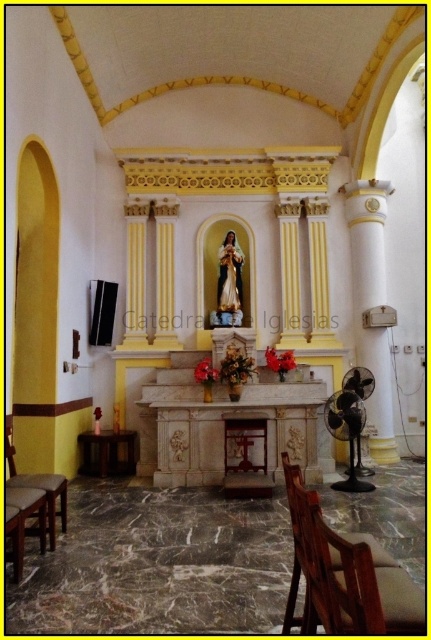
You are standing in the church and need to sit down. You see a wooden chair at lower right and a black plastic fan at lower right. Which object is closer to you?

The wooden chair at lower right is positioned over the black plastic fan at lower right, meaning it is closer to you.

You are a visitor standing at the entrance of the church and want to sit down. You see a wooden chair at lower right and a black plastic fan at lower right. Which object is shorter and thus more suitable for sitting?

Result: The wooden chair at lower right is not as tall as the black plastic fan at lower right, so the wooden chair at lower right is shorter and more suitable for sitting.

You are a maintenance worker needing to reach the black plastic fan at lower right and the brown leather chair at lower left. You have a ladder that is 3.5 meters long. Can you use this ladder to reach both objects without moving it?

The distance between the black plastic fan at lower right and brown leather chair at lower left is 3.49 meters, so the ladder is just slightly longer than the distance. However, ladders are not typically used to span between two objects as they need to be placed against a stable surface. Therefore, the ladder cannot be used to reach both objects without moving it.